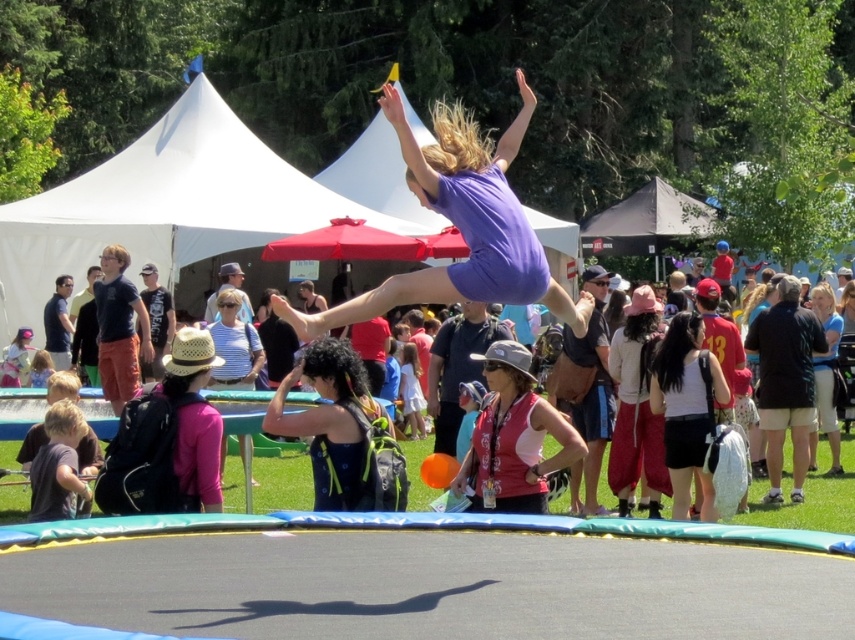
Consider the image. Can you confirm if matte purple shorts at center is positioned below white matte shorts at center?

No, matte purple shorts at center is not below white matte shorts at center.

Does matte purple shorts at center have a greater width compared to white matte shorts at center?

Correct, the width of matte purple shorts at center exceeds that of white matte shorts at center.

Is point (264, 458) in front of point (694, 474)?

No, it is not.

Where is `matte purple shorts at center`? matte purple shorts at center is located at coordinates (812, 500).

Between white matte shorts at center and pink fabric hat at center, which one has more height?

pink fabric hat at center is taller.

Does white matte shorts at center appear on the left side of pink fabric hat at center?

Incorrect, white matte shorts at center is not on the left side of pink fabric hat at center.

The width and height of the screenshot is (855, 640). Identify the location of white matte shorts at center. (687, 406).

This screenshot has height=640, width=855. What do you see at coordinates (340, 429) in the screenshot?
I see `dark blue fabric backpack at center` at bounding box center [340, 429].

Based on the photo, does dark blue fabric backpack at center have a smaller size compared to white matte shorts at center?

Indeed, dark blue fabric backpack at center has a smaller size compared to white matte shorts at center.

Find the location of a particular element. dark blue fabric backpack at center is located at coordinates tap(340, 429).

Image resolution: width=855 pixels, height=640 pixels. What are the coordinates of `dark blue fabric backpack at center` in the screenshot? It's located at (340, 429).